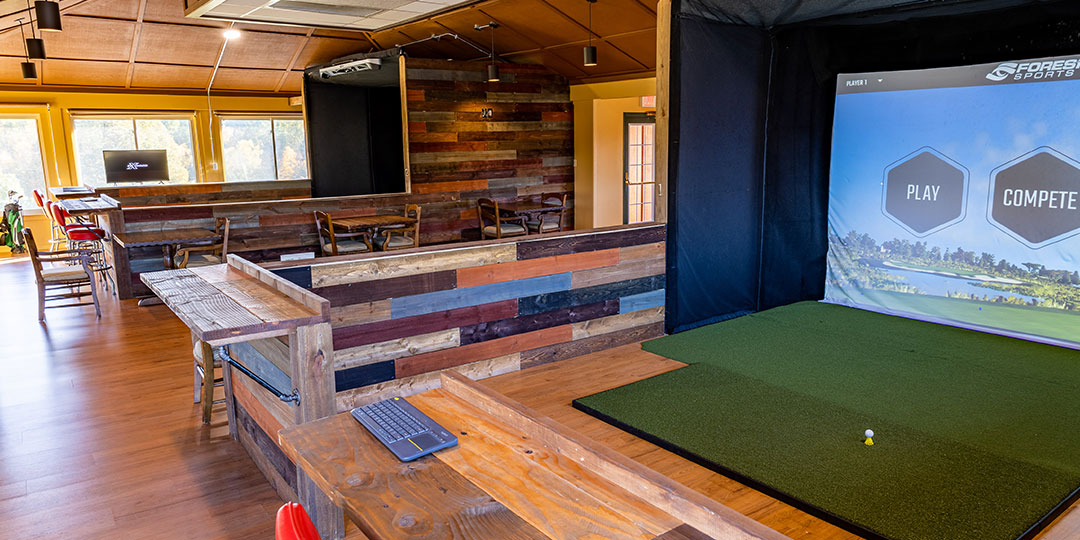
Where is `floor`? The image size is (1080, 540). floor is located at coordinates pyautogui.click(x=110, y=464), pyautogui.click(x=554, y=386).